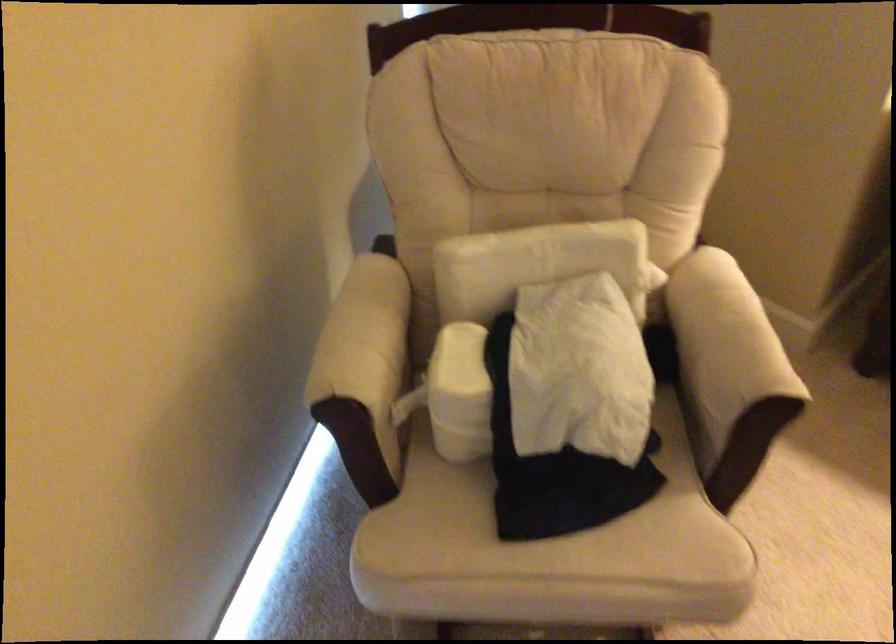
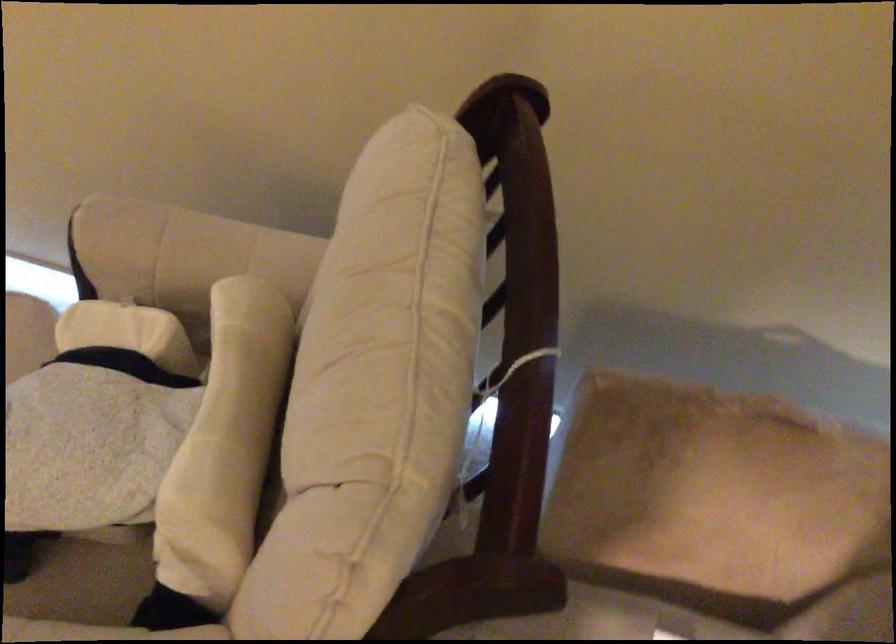
The point at [595,225] is marked in the first image. Where is the corresponding point in the second image?

(225, 444)